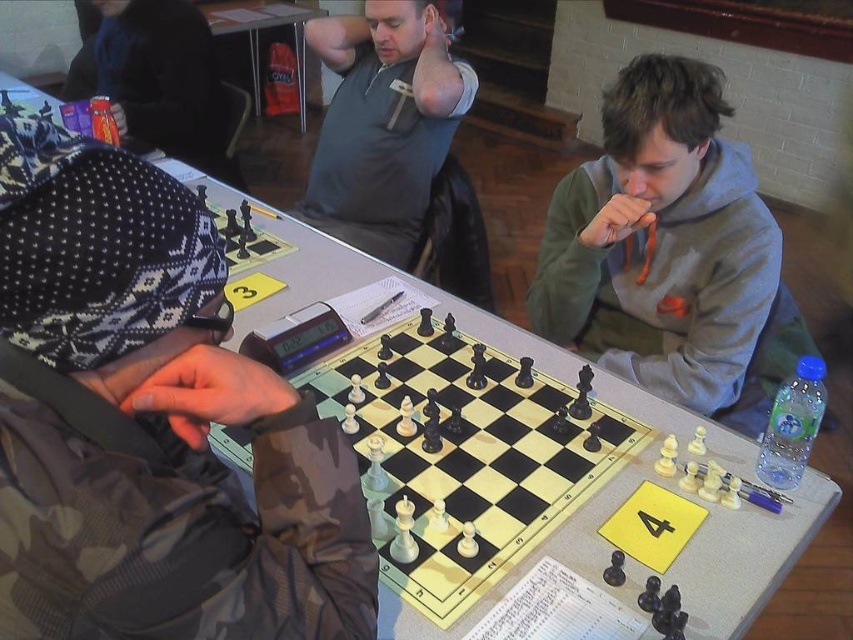
Describe the element at coordinates (149, 424) in the screenshot. The width and height of the screenshot is (853, 640). I see `camo fabric jacket at left` at that location.

The image size is (853, 640). Describe the element at coordinates (149, 424) in the screenshot. I see `camo fabric jacket at left` at that location.

The width and height of the screenshot is (853, 640). I want to click on camo fabric jacket at left, so click(x=149, y=424).

Is gray fleece hoodie at center closer to the viewer compared to gray matte shirt at center?

That is True.

Can you confirm if gray fleece hoodie at center is positioned to the left of gray matte shirt at center?

Incorrect, gray fleece hoodie at center is not on the left side of gray matte shirt at center.

This screenshot has height=640, width=853. What do you see at coordinates (660, 241) in the screenshot?
I see `gray fleece hoodie at center` at bounding box center [660, 241].

At what (x,y) coordinates should I click in order to perform the action: click on gray fleece hoodie at center. Please return your answer as a coordinate pair (x, y). Looking at the image, I should click on (660, 241).

Which is below, camo fabric jacket at left or gray fleece hoodie at center?

Positioned lower is camo fabric jacket at left.

Who is more distant from viewer, (35, 129) or (701, 244)?

Positioned behind is point (701, 244).

Locate an element on the screen. This screenshot has width=853, height=640. camo fabric jacket at left is located at coordinates (149, 424).

This screenshot has width=853, height=640. I want to click on camo fabric jacket at left, so click(149, 424).